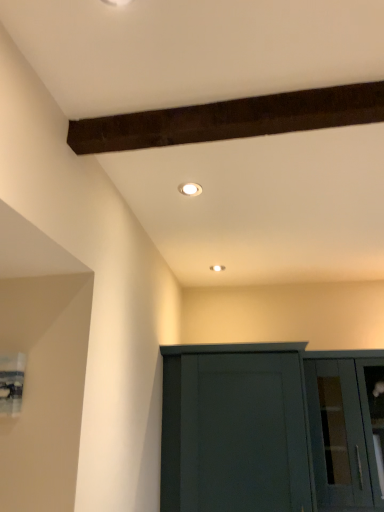
What are the coordinates of `matte dark green cupboard at lower center` in the screenshot? It's located at (271, 429).

Is transparent glass cabinet at lower right facing towards matte dark green cupboard at lower center?

No.

Between transparent glass cabinet at lower right and matte dark green cupboard at lower center, which one has larger width?

Wider between the two is matte dark green cupboard at lower center.

In the scene shown: Between transparent glass cabinet at lower right and matte dark green cupboard at lower center, which one has less height?

With less height is transparent glass cabinet at lower right.

From a real-world perspective, who is located lower, transparent glass cabinet at lower right or matte dark green cupboard at lower center?

In real-world perspective, transparent glass cabinet at lower right is lower.

Does transparent glass cabinet at lower right have a greater width compared to white glossy light fixture at upper center?

Yes, transparent glass cabinet at lower right is wider than white glossy light fixture at upper center.

Is white glossy light fixture at upper center inside transparent glass cabinet at lower right?

That's incorrect, white glossy light fixture at upper center is not inside transparent glass cabinet at lower right.

From a real-world perspective, is transparent glass cabinet at lower right physically located above or below white glossy light fixture at upper center?

transparent glass cabinet at lower right is below white glossy light fixture at upper center.

Is transparent glass cabinet at lower right looking in the opposite direction of white glossy light fixture at upper center?

transparent glass cabinet at lower right does not have its back to white glossy light fixture at upper center.

Is white glossy light fixture at upper center oriented towards transparent glass cabinet at lower right?

No, white glossy light fixture at upper center does not turn towards transparent glass cabinet at lower right.

Considering the positions of objects white glossy light fixture at upper center and transparent glass cabinet at lower right in the image provided, who is in front, white glossy light fixture at upper center or transparent glass cabinet at lower right?

white glossy light fixture at upper center.

From a real-world perspective, is white glossy light fixture at upper center above or below transparent glass cabinet at lower right?

white glossy light fixture at upper center is above transparent glass cabinet at lower right.

From the image's perspective, is matte dark green cupboard at lower center below transparent glass cabinet at lower right?

Actually, matte dark green cupboard at lower center appears above transparent glass cabinet at lower right in the image.

Looking at this image, how many degrees apart are the facing directions of matte dark green cupboard at lower center and transparent glass cabinet at lower right?

The facing directions of matte dark green cupboard at lower center and transparent glass cabinet at lower right are 0.000146 degrees apart.

In the scene shown: Who is more distant, matte dark green cupboard at lower center or transparent glass cabinet at lower right?

transparent glass cabinet at lower right.

From a real-world perspective, is matte dark green cupboard at lower center physically located above or below transparent glass cabinet at lower right?

matte dark green cupboard at lower center is above transparent glass cabinet at lower right.

Does matte dark green cupboard at lower center come behind white glossy light fixture at upper center?

That is True.

From a real-world perspective, does matte dark green cupboard at lower center stand above white glossy light fixture at upper center?

No, from a real-world perspective, matte dark green cupboard at lower center is not above white glossy light fixture at upper center.

Is matte dark green cupboard at lower center outside of white glossy light fixture at upper center?

That's correct, matte dark green cupboard at lower center is outside of white glossy light fixture at upper center.

Does white glossy light fixture at upper center come in front of matte dark green cupboard at lower center?

Yes, it is in front of matte dark green cupboard at lower center.

Is point (188, 189) closer to viewer compared to point (361, 449)?

Yes, point (188, 189) is closer to viewer.

Between white glossy light fixture at upper center and matte dark green cupboard at lower center, which one has smaller size?

white glossy light fixture at upper center.

Does white glossy light fixture at upper center have a greater height compared to matte dark green cupboard at lower center?

In fact, white glossy light fixture at upper center may be shorter than matte dark green cupboard at lower center.

Locate an element on the screen. The image size is (384, 512). glass door behind the matte dark green cupboard at lower center is located at coordinates (347, 428).

Locate an element on the screen. glass door that is on the right side of white glossy light fixture at upper center is located at coordinates (347, 428).

From the image, which object appears to be nearer to matte dark green cupboard at lower center, transparent glass cabinet at lower right or white glossy light fixture at upper center?

Among the two, transparent glass cabinet at lower right is located nearer to matte dark green cupboard at lower center.

When comparing their distances from matte dark green cupboard at lower center, does white glossy light fixture at upper center or transparent glass cabinet at lower right seem closer?

Among the two, transparent glass cabinet at lower right is located nearer to matte dark green cupboard at lower center.

Based on their spatial positions, is white glossy light fixture at upper center or matte dark green cupboard at lower center closer to transparent glass cabinet at lower right?

matte dark green cupboard at lower center is closer to transparent glass cabinet at lower right.

From the image, which object appears to be nearer to white glossy light fixture at upper center, transparent glass cabinet at lower right or matte dark green cupboard at lower center?

Based on the image, matte dark green cupboard at lower center appears to be nearer to white glossy light fixture at upper center.

From the picture: Which object lies nearer to the anchor point white glossy light fixture at upper center, matte dark green cupboard at lower center or transparent glass cabinet at lower right?

matte dark green cupboard at lower center is positioned closer to the anchor white glossy light fixture at upper center.

Considering their positions, is matte dark green cupboard at lower center positioned closer to transparent glass cabinet at lower right than white glossy light fixture at upper center?

matte dark green cupboard at lower center lies closer to transparent glass cabinet at lower right than the other object.

What are the coordinates of `cupboard between white glossy light fixture at upper center and transparent glass cabinet at lower right from top to bottom` in the screenshot? It's located at (271, 429).